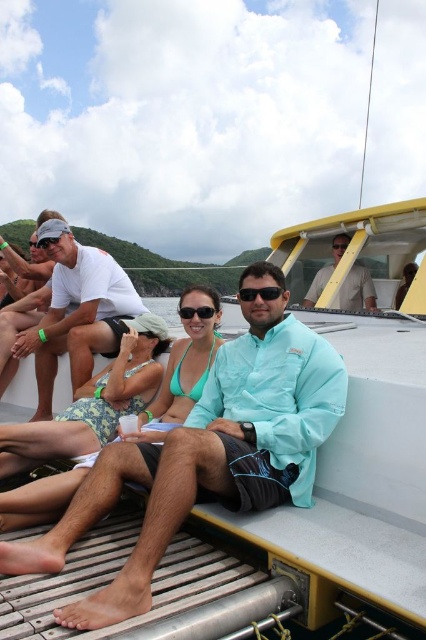
Question: Is black plastic sunglasses at center further to the viewer compared to matte black sunglasses at center?

Choices:
 (A) yes
 (B) no

Answer: (B)

Question: Considering the real-world distances, which object is farthest from the white matte shirt at center?

Choices:
 (A) teal fabric shirt at center
 (B) black plastic goggles at center
 (C) black plastic sunglasses at center
 (D) matte black sunglasses at upper left

Answer: (B)

Question: Which point appears farthest from the camera in this image?

Choices:
 (A) (103, 278)
 (B) (264, 292)
 (C) (342, 284)
 (D) (345, 241)

Answer: (D)

Question: Which object appears closest to the camera in this image?

Choices:
 (A) black rubber goggles at center
 (B) black plastic goggles at center
 (C) matte black sunglasses at upper left
 (D) matte black sunglasses at center

Answer: (D)

Question: Is white matte shirt at center to the right of matte black sunglasses at upper left from the viewer's perspective?

Choices:
 (A) yes
 (B) no

Answer: (A)

Question: Can you confirm if teal fabric shirt at center is positioned above black plastic sunglasses at center?

Choices:
 (A) no
 (B) yes

Answer: (A)